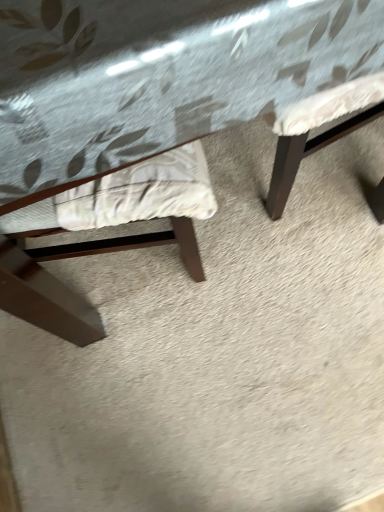
Question: Is the position of wooden table at center more distant than that of fabric cushioned chair at left?

Choices:
 (A) yes
 (B) no

Answer: (B)

Question: Is the position of wooden table at center less distant than that of fabric cushioned chair at left?

Choices:
 (A) no
 (B) yes

Answer: (B)

Question: Does wooden table at center have a lesser height compared to fabric cushioned chair at left?

Choices:
 (A) no
 (B) yes

Answer: (B)

Question: From a real-world perspective, is wooden table at center positioned under fabric cushioned chair at left based on gravity?

Choices:
 (A) no
 (B) yes

Answer: (B)

Question: Can you confirm if wooden table at center is wider than fabric cushioned chair at left?

Choices:
 (A) yes
 (B) no

Answer: (A)

Question: Is wooden table at center at the right side of fabric cushioned chair at left?

Choices:
 (A) no
 (B) yes

Answer: (B)

Question: Does fabric cushioned chair at left come behind wooden table at center?

Choices:
 (A) no
 (B) yes

Answer: (B)

Question: Is fabric cushioned chair at left outside of wooden table at center?

Choices:
 (A) yes
 (B) no

Answer: (B)

Question: Considering the relative positions of fabric cushioned chair at left and wooden table at center in the image provided, is fabric cushioned chair at left to the left of wooden table at center from the viewer's perspective?

Choices:
 (A) yes
 (B) no

Answer: (A)

Question: Would you say wooden table at center is part of fabric cushioned chair at left's contents?

Choices:
 (A) yes
 (B) no

Answer: (B)

Question: From the image's perspective, does fabric cushioned chair at left appear higher than wooden table at center?

Choices:
 (A) no
 (B) yes

Answer: (A)

Question: Is the position of fabric cushioned chair at left less distant than that of wooden table at center?

Choices:
 (A) no
 (B) yes

Answer: (A)

Question: Relative to fabric cushioned chair at left, is wooden table at center in front or behind?

Choices:
 (A) behind
 (B) front

Answer: (B)